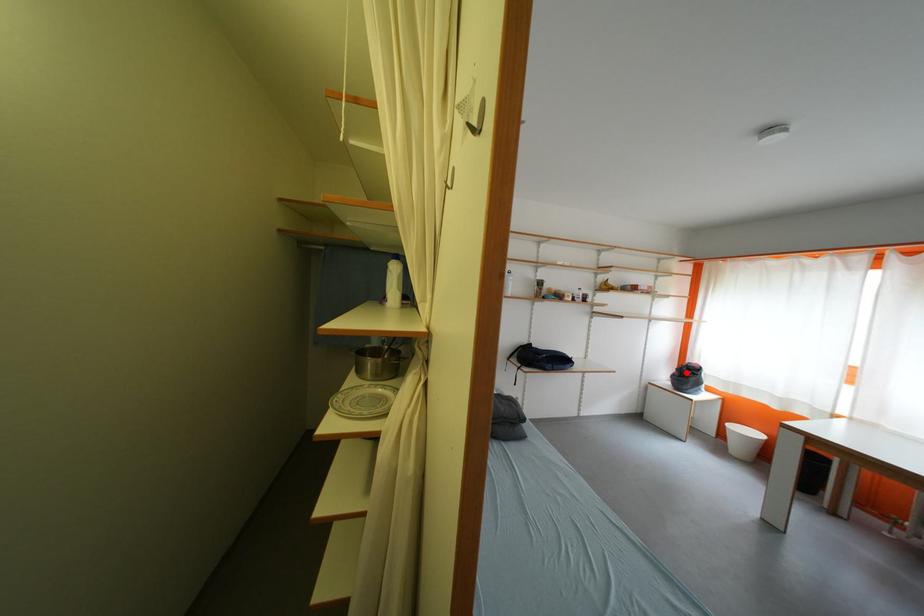
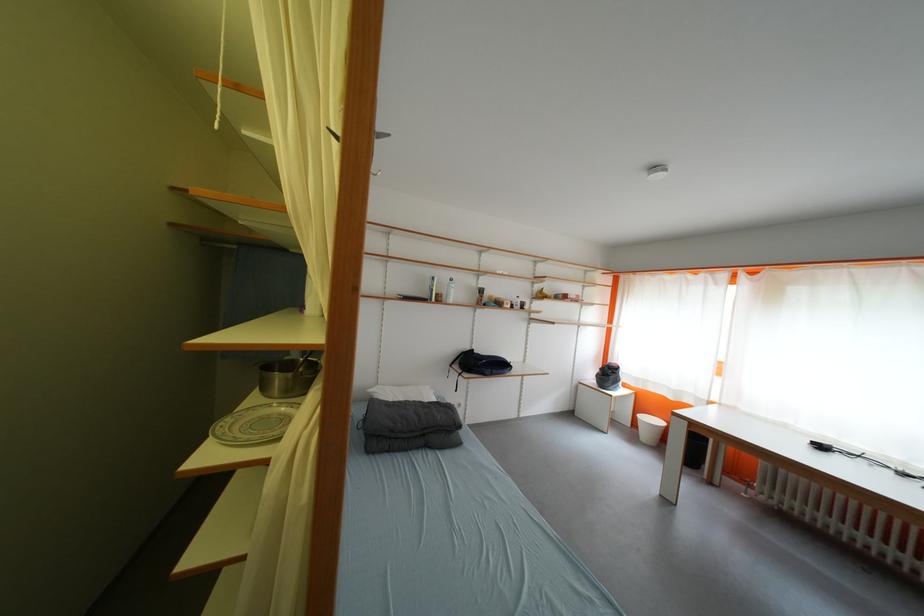
Find the pixel in the second image that matches the highlighted location in the first image.

(610, 371)